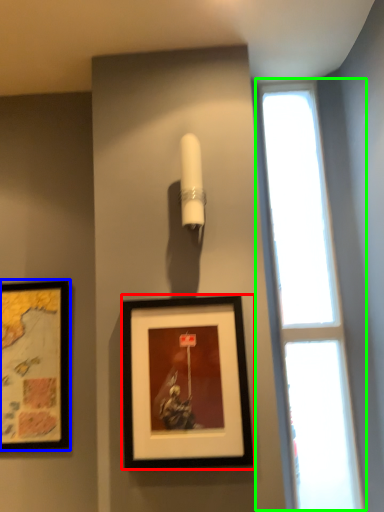
Question: Estimate the real-world distances between objects in this image. Which object is farther from picture frame (highlighted by a red box), picture frame (highlighted by a blue box) or window (highlighted by a green box)?

Choices:
 (A) picture frame
 (B) window

Answer: (A)